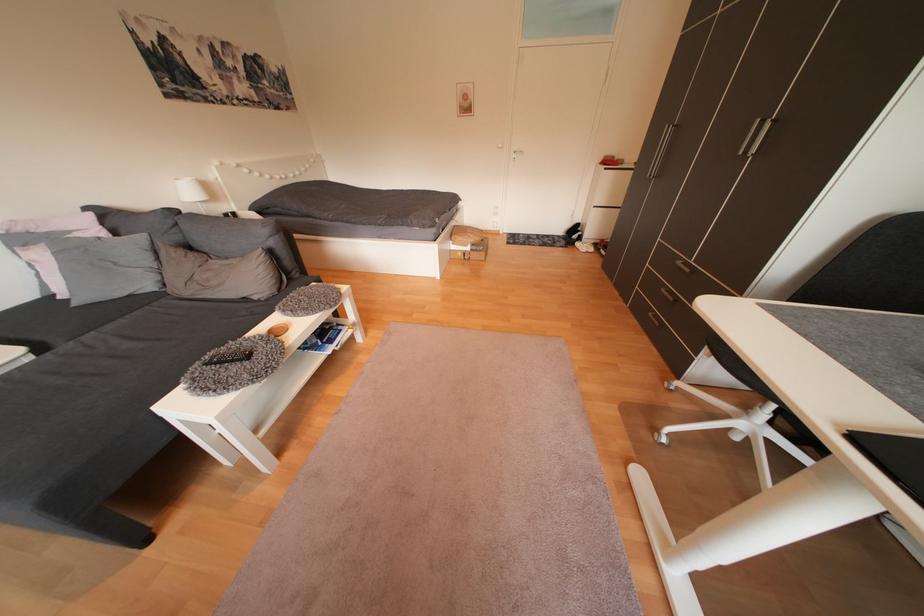
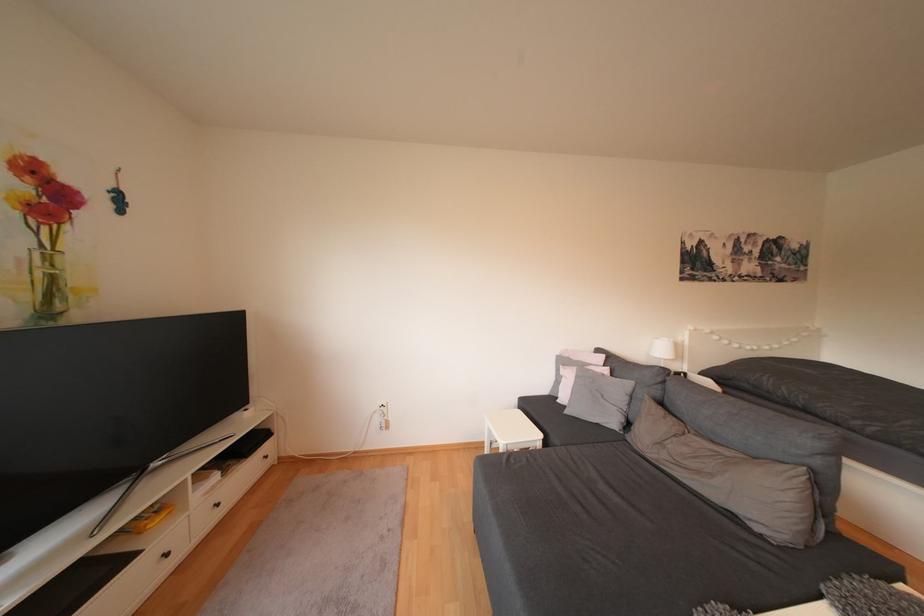
Question: Based on the continuous images, in which direction is the camera rotating? Reply with the corresponding letter.

Choices:
 (A) Left
 (B) Right
 (C) Up
 (D) Down

Answer: (A)